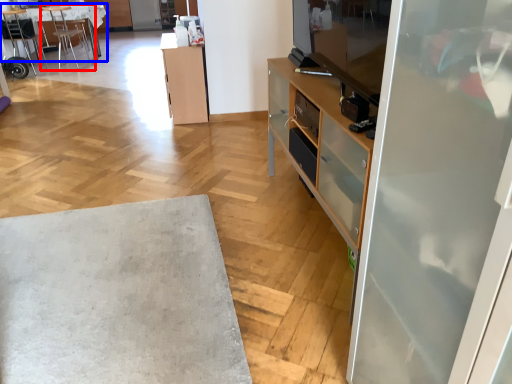
Question: Which of the following is the farthest to the observer, chair (highlighted by a red box) or desk (highlighted by a blue box)?

Choices:
 (A) chair
 (B) desk

Answer: (B)